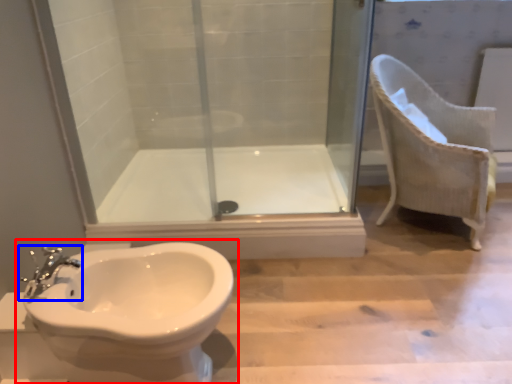
Question: Among these objects, which one is nearest to the camera, toilet (highlighted by a red box) or tap (highlighted by a blue box)?

Choices:
 (A) toilet
 (B) tap

Answer: (A)